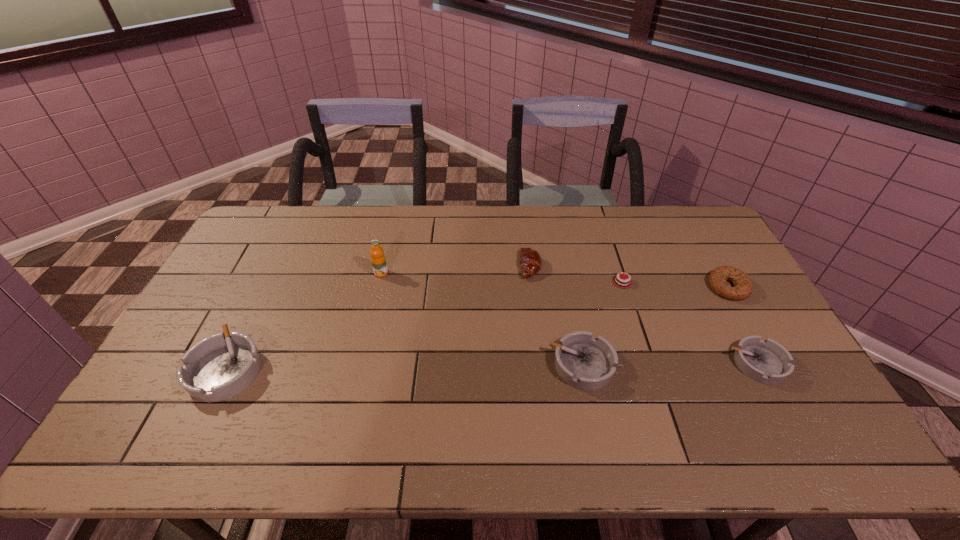
This screenshot has width=960, height=540. In order to click on object positioned at the near right corner in this screenshot , I will do `click(766, 361)`.

Image resolution: width=960 pixels, height=540 pixels. I want to click on vacant region at the far edge, so pyautogui.click(x=371, y=218).

Locate an element on the screen. The height and width of the screenshot is (540, 960). free space at the near edge of the desktop is located at coordinates (467, 393).

The width and height of the screenshot is (960, 540). In order to click on vacant space at the left edge in this screenshot , I will do `click(219, 276)`.

Find the location of a particular element. free space at the right edge of the desktop is located at coordinates (745, 323).

You are a GUI agent. You are given a task and a screenshot of the screen. Output one action in this format:
    pyautogui.click(x=<x>, y=<y>)
    Task: Click on the free space at the far left corner of the desktop
    
    Given the screenshot: What is the action you would take?
    pyautogui.click(x=287, y=220)

The image size is (960, 540). Find the location of `free spot at the far right corner of the desktop`. free spot at the far right corner of the desktop is located at coordinates (678, 244).

The image size is (960, 540). What are the coordinates of `free space between the crescent roll and the rightmost ashtray` in the screenshot? It's located at (644, 315).

Find the location of a particular element. This screenshot has width=960, height=540. vacant region between the crescent roll and the shortest ashtray is located at coordinates (644, 315).

What are the coordinates of `free space that is in between the bagel and the second ashtray from left to right` in the screenshot? It's located at (655, 326).